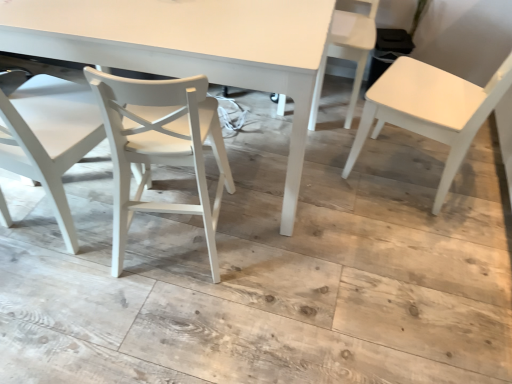
The image size is (512, 384). Identify the location of free space in front of white matte chair at right, placed as the fourth chair when sorted from left to right. (419, 247).